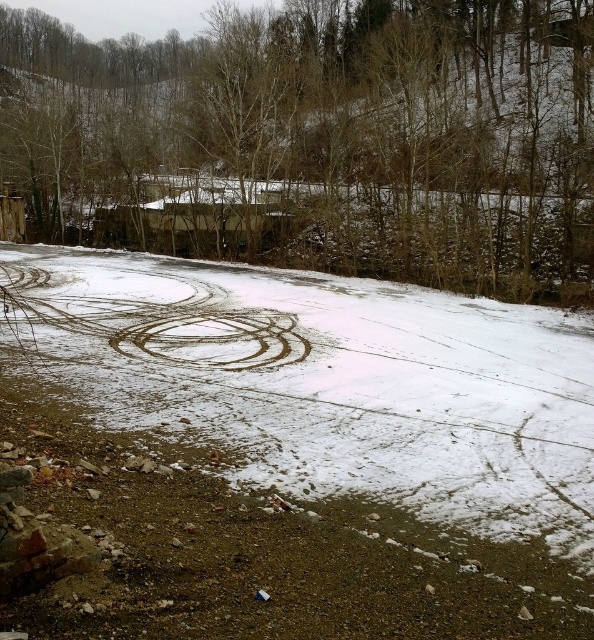
You are a hiker trying to follow a path through the snowy landscape. You notice two tracks in the middle of the image. Which one is the larger path, the brown gravel dirt track at center or the brown dirt track at center?

The brown gravel dirt track at center has a larger size compared to the brown dirt track at center, so the brown gravel dirt track at center is the larger path.

You are a hiker trying to navigate through the snowy landscape. You see a brown leafless tree at center and a brown dirt track at center. Which one is higher up in the image?

The brown leafless tree at center is above the brown dirt track at center, so the tree is higher up in the image.